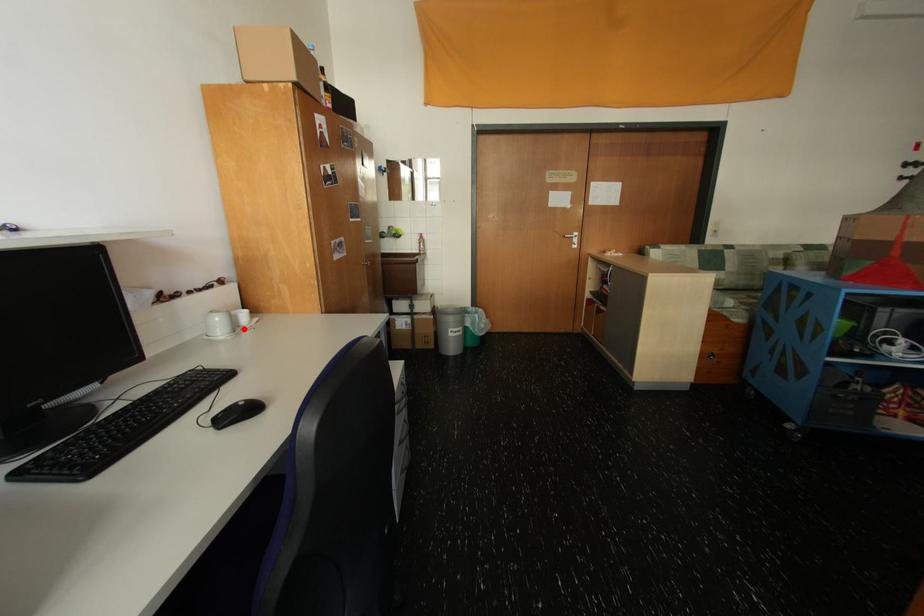
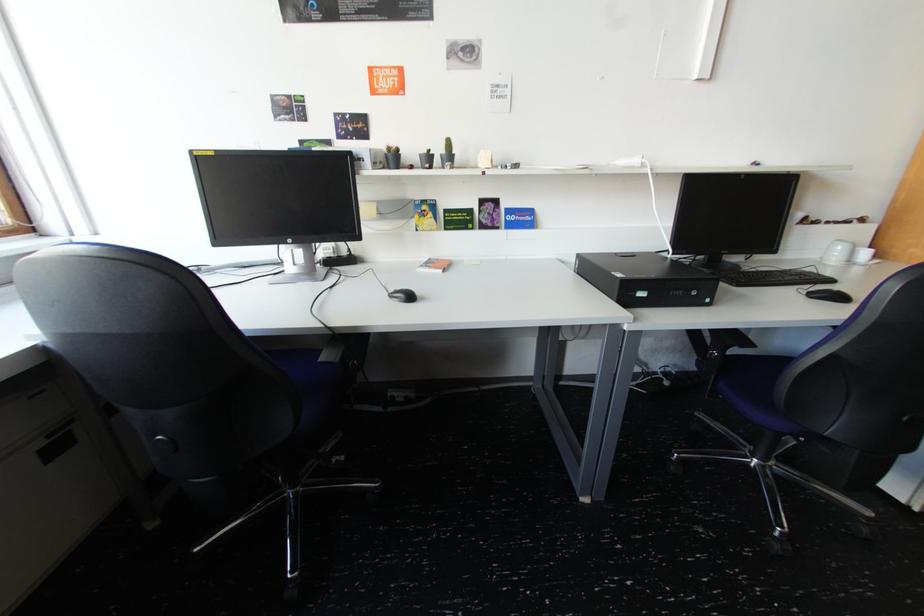
Question: I am providing you with two images of the same scene from different viewpoints. Image1 has a red point marked. In image2, the corresponding 3D location appears at what relative position? Reply with the corresponding letter.

Choices:
 (A) Closer
 (B) Farther

Answer: (B)